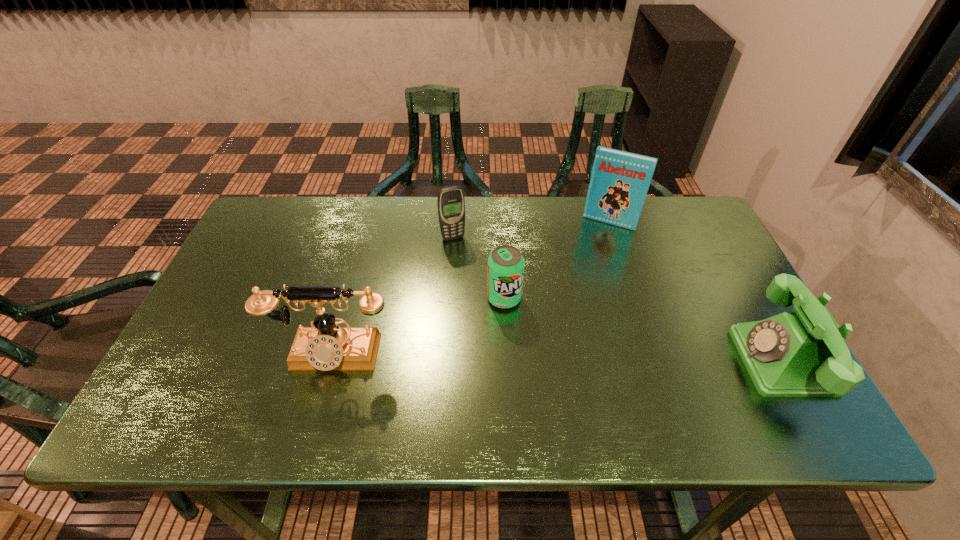
This screenshot has height=540, width=960. What are the coordinates of `free region at the far left corner of the desktop` in the screenshot? It's located at (277, 197).

This screenshot has height=540, width=960. Identify the location of vacant region between the third object from left to right and the second farthest object. (478, 268).

You are a GUI agent. You are given a task and a screenshot of the screen. Output one action in this format:
    pyautogui.click(x=<x>, y=<y>)
    Task: Click on the free space between the shorter telephone and the fourth nearest object
    This screenshot has height=540, width=960.
    Given the screenshot: What is the action you would take?
    pyautogui.click(x=617, y=299)

Identify the location of empty location between the second object from left to right and the rightmost object. (617, 299).

Find the location of a particular element. vacant region between the fourth nearest object and the third nearest object is located at coordinates (478, 268).

The height and width of the screenshot is (540, 960). I want to click on free space between the book and the taller telephone, so click(x=471, y=289).

Locate an element on the screen. The image size is (960, 540). free space between the second object from left to right and the pop soda is located at coordinates (478, 268).

At what (x,y) coordinates should I click in order to perform the action: click on free space between the farthest object and the pop soda. Please return your answer as a coordinate pair (x, y). Image resolution: width=960 pixels, height=540 pixels. Looking at the image, I should click on (x=557, y=260).

Where is `unoccupied area between the second farthest object and the left telephone`? unoccupied area between the second farthest object and the left telephone is located at coordinates (393, 296).

Locate an element on the screen. vacant area between the cellular telephone and the book is located at coordinates (531, 230).